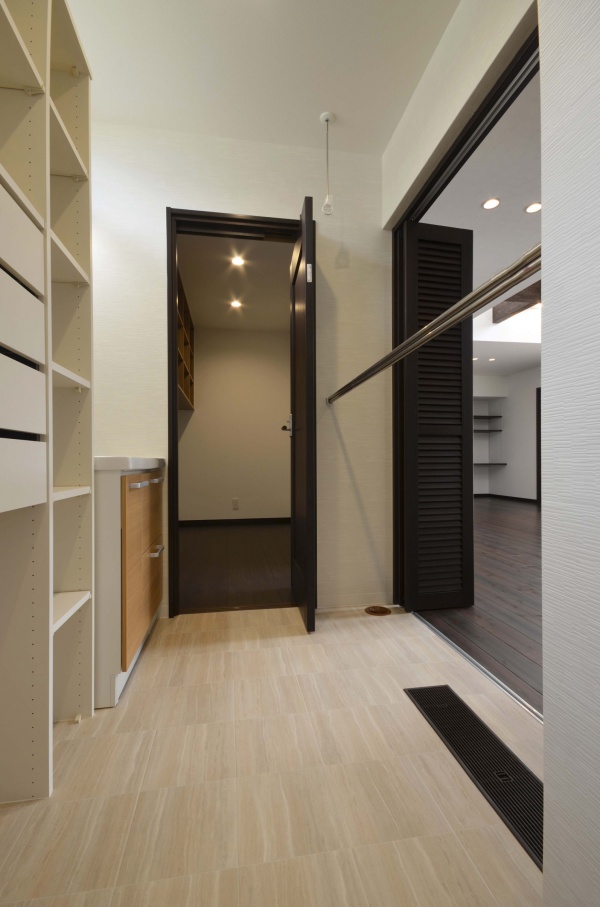
The height and width of the screenshot is (907, 600). I want to click on handles, so click(x=159, y=550), click(x=138, y=483), click(x=157, y=479).